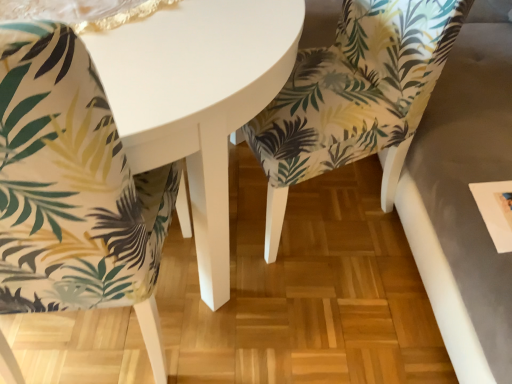
Question: Relative to palm-patterned fabric chair at lower left, arranged as the first chair when viewed from the left, is white glossy table at center in front or behind?

Choices:
 (A) behind
 (B) front

Answer: (A)

Question: From the image's perspective, is white glossy table at center above or below palm-patterned fabric chair at lower left, arranged as the first chair when viewed from the left?

Choices:
 (A) below
 (B) above

Answer: (B)

Question: Which object is the farthest from the white glossy table at center?

Choices:
 (A) palm-patterned fabric chair at lower left, arranged as the first chair when viewed from the left
 (B) printed fabric chair at center, marked as the second chair in a left-to-right arrangement

Answer: (B)

Question: Estimate the real-world distances between objects in this image. Which object is farther from the white glossy table at center?

Choices:
 (A) printed fabric chair at center, which is the 1th chair from right to left
 (B) palm-patterned fabric chair at lower left, marked as the 2th chair in a right-to-left arrangement

Answer: (A)